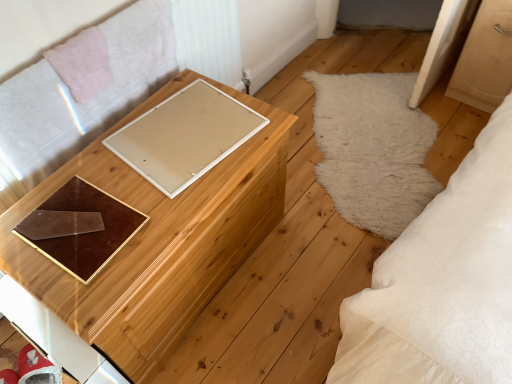
The width and height of the screenshot is (512, 384). What are the coordinates of `vacant space behind brown glossy tray at center` in the screenshot? It's located at (95, 169).